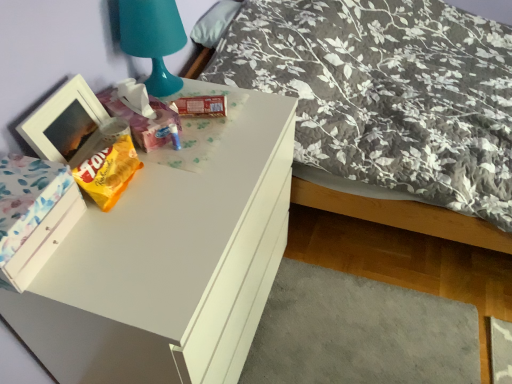
Where is `vacant area that is situated to the right of yellow matte snack packet at left`? The width and height of the screenshot is (512, 384). vacant area that is situated to the right of yellow matte snack packet at left is located at coordinates (185, 187).